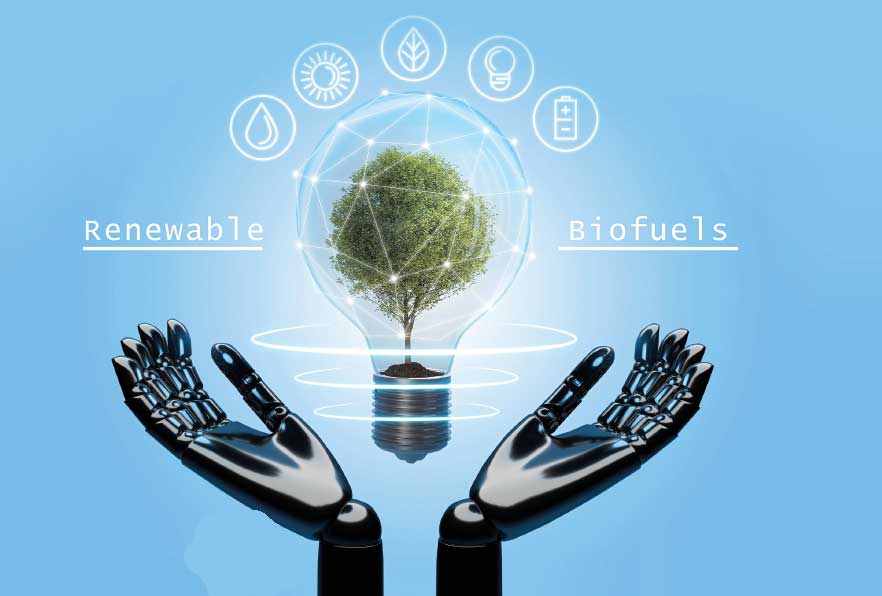
Identify the location of light bulbs. This screenshot has width=882, height=596. (506, 74), (516, 209).